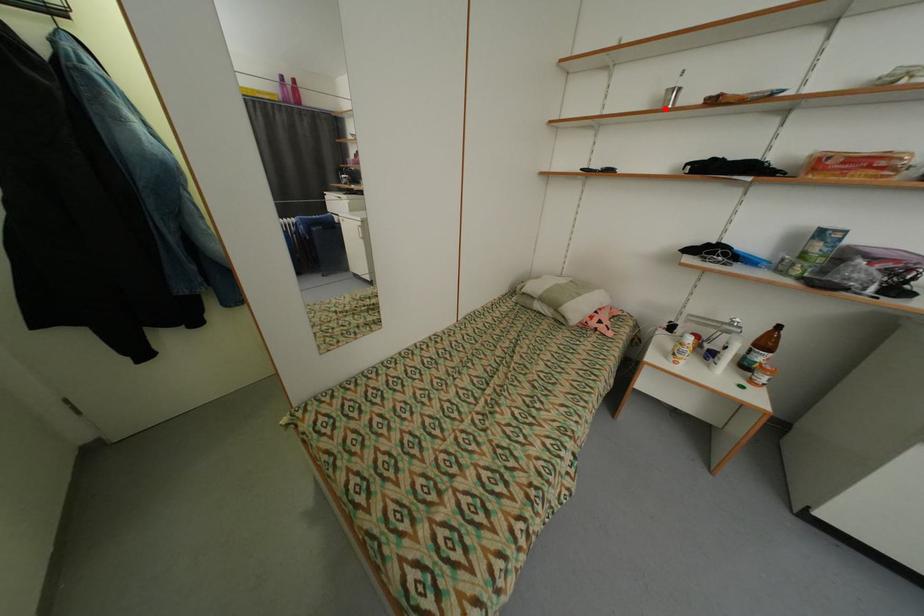
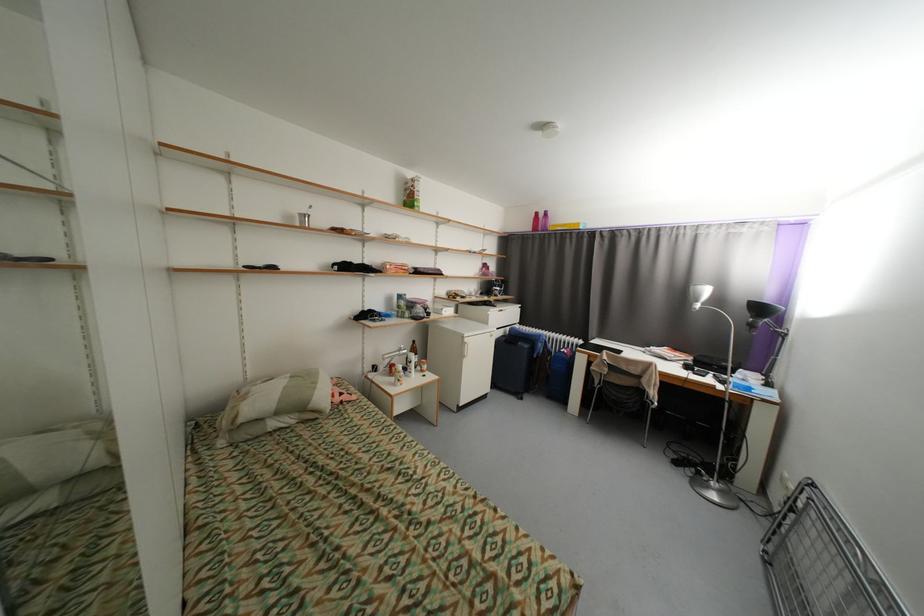
In the second image, find the point that corresponds to the highlighted location in the first image.

(305, 225)